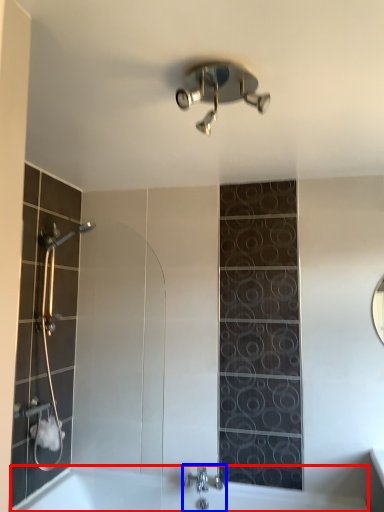
Question: Which object appears closest to the camera in this image, bath (highlighted by a red box) or tap (highlighted by a blue box)?

Choices:
 (A) bath
 (B) tap

Answer: (A)